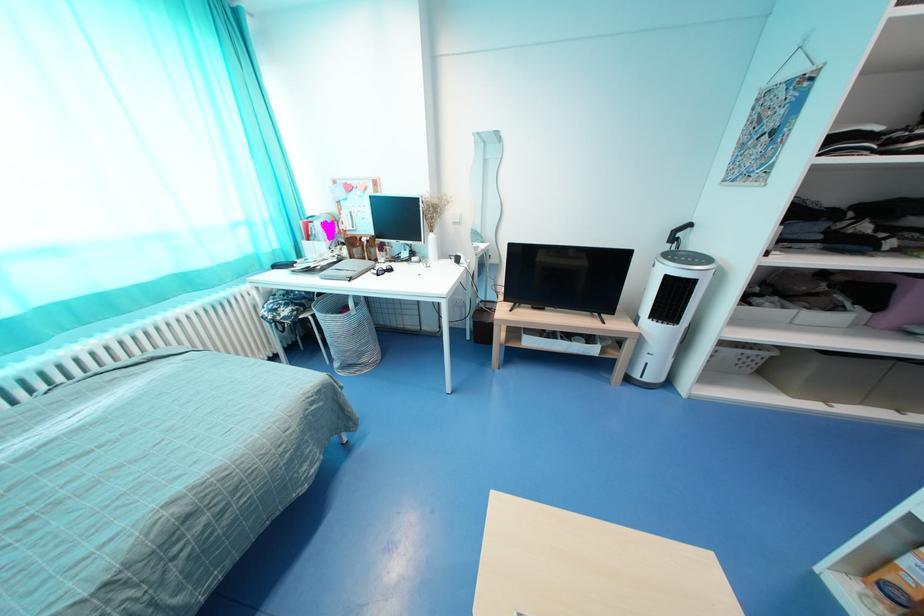
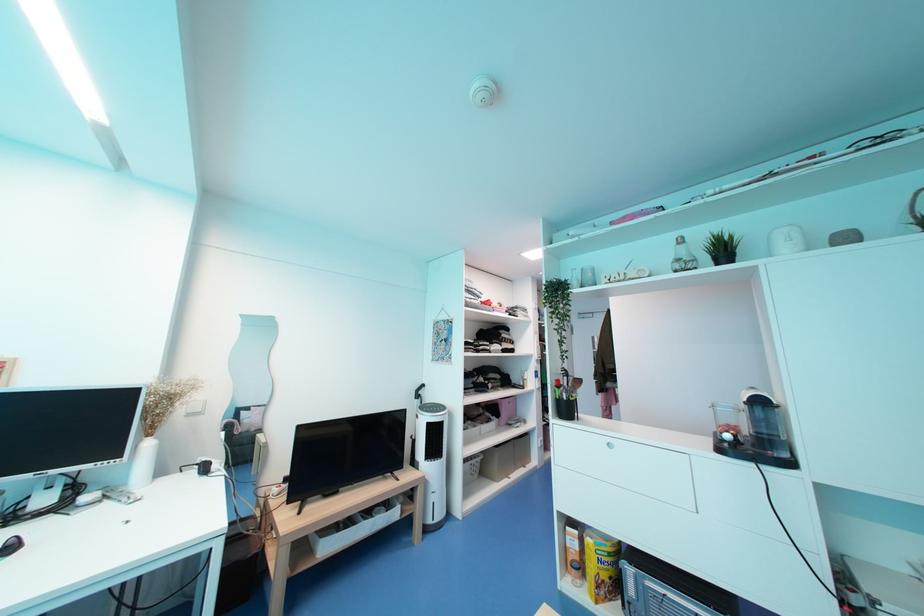
The images are taken continuously from a first-person perspective. In which direction is your viewpoint rotating?

The camera's rotation is toward right-up.